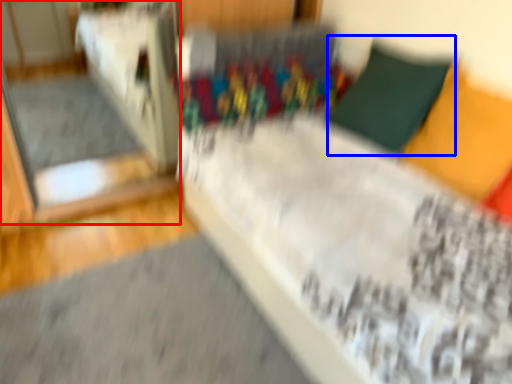
Question: Among these objects, which one is nearest to the camera, glass door (highlighted by a red box) or pillow (highlighted by a blue box)?

Choices:
 (A) glass door
 (B) pillow

Answer: (B)